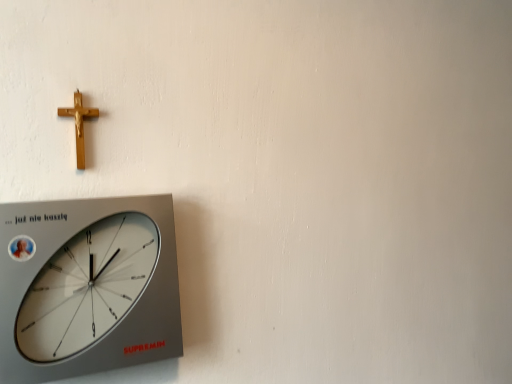
Question: Considering the relative positions of silver metallic wall clock at lower left and gold polished crucifix at upper left in the image provided, is silver metallic wall clock at lower left to the left of gold polished crucifix at upper left from the viewer's perspective?

Choices:
 (A) yes
 (B) no

Answer: (B)

Question: Is silver metallic wall clock at lower left bigger than gold polished crucifix at upper left?

Choices:
 (A) yes
 (B) no

Answer: (A)

Question: Would you say gold polished crucifix at upper left is part of silver metallic wall clock at lower left's contents?

Choices:
 (A) yes
 (B) no

Answer: (B)

Question: Can you confirm if silver metallic wall clock at lower left is wider than gold polished crucifix at upper left?

Choices:
 (A) no
 (B) yes

Answer: (B)

Question: Is silver metallic wall clock at lower left further to camera compared to gold polished crucifix at upper left?

Choices:
 (A) yes
 (B) no

Answer: (B)

Question: Is silver metallic wall clock at lower left to the right of gold polished crucifix at upper left from the viewer's perspective?

Choices:
 (A) yes
 (B) no

Answer: (A)

Question: Are gold polished crucifix at upper left and silver metallic wall clock at lower left far apart?

Choices:
 (A) no
 (B) yes

Answer: (A)

Question: Is gold polished crucifix at upper left facing towards silver metallic wall clock at lower left?

Choices:
 (A) no
 (B) yes

Answer: (A)

Question: From the image's perspective, is gold polished crucifix at upper left above silver metallic wall clock at lower left?

Choices:
 (A) yes
 (B) no

Answer: (A)

Question: Is gold polished crucifix at upper left with silver metallic wall clock at lower left?

Choices:
 (A) yes
 (B) no

Answer: (B)

Question: Does gold polished crucifix at upper left have a smaller size compared to silver metallic wall clock at lower left?

Choices:
 (A) yes
 (B) no

Answer: (A)

Question: From the image's perspective, is gold polished crucifix at upper left under silver metallic wall clock at lower left?

Choices:
 (A) no
 (B) yes

Answer: (A)

Question: From the image's perspective, is silver metallic wall clock at lower left located above or below gold polished crucifix at upper left?

Choices:
 (A) above
 (B) below

Answer: (B)